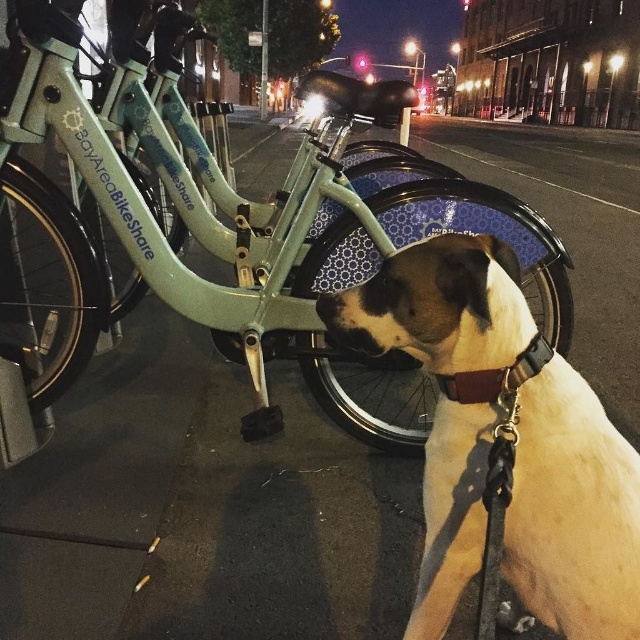
Question: In this image, where is matte green bicycle at center located relative to white fur dog at center?

Choices:
 (A) left
 (B) right

Answer: (A)

Question: Which of these objects is positioned closest to the white fur dog at center?

Choices:
 (A) black rubber nose at center
 (B) matte green bicycle at center

Answer: (A)

Question: Does white fur dog at center have a lesser width compared to black rubber nose at center?

Choices:
 (A) no
 (B) yes

Answer: (A)

Question: Which object appears closest to the camera in this image?

Choices:
 (A) white fur dog at center
 (B) black rubber nose at center
 (C) matte green bicycle at center

Answer: (A)

Question: Can you confirm if white fur dog at center is positioned to the left of black rubber nose at center?

Choices:
 (A) no
 (B) yes

Answer: (A)

Question: Which object is closer to the camera taking this photo?

Choices:
 (A) white fur dog at center
 (B) matte green bicycle at center

Answer: (A)